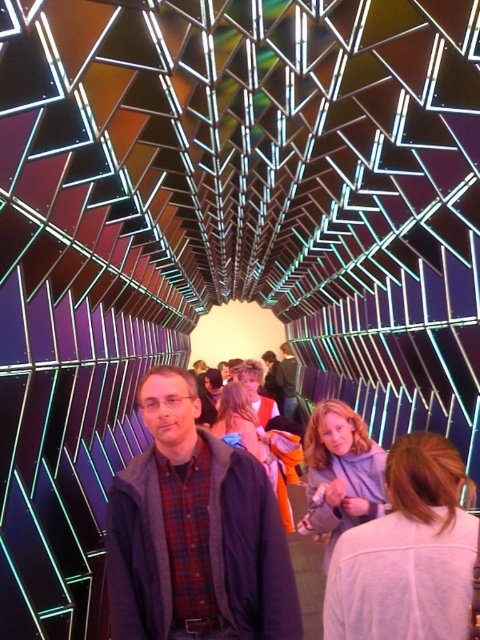
You are a photographer positioned at the entrance of the tunnel. You want to capture a photo where the plaid shirt at center and the matte black jacket at center are both visible. Which object will appear closer to the top of the photo?

The plaid shirt at center is shorter than the matte black jacket at center, so the matte black jacket at center will appear closer to the top of the photo because it is taller.

You are standing at the entrance of the tunnel and see the point marked at coordinates (194,532). What object is located at that point?

The point at coordinates (194,532) corresponds to the plaid shirt at center.